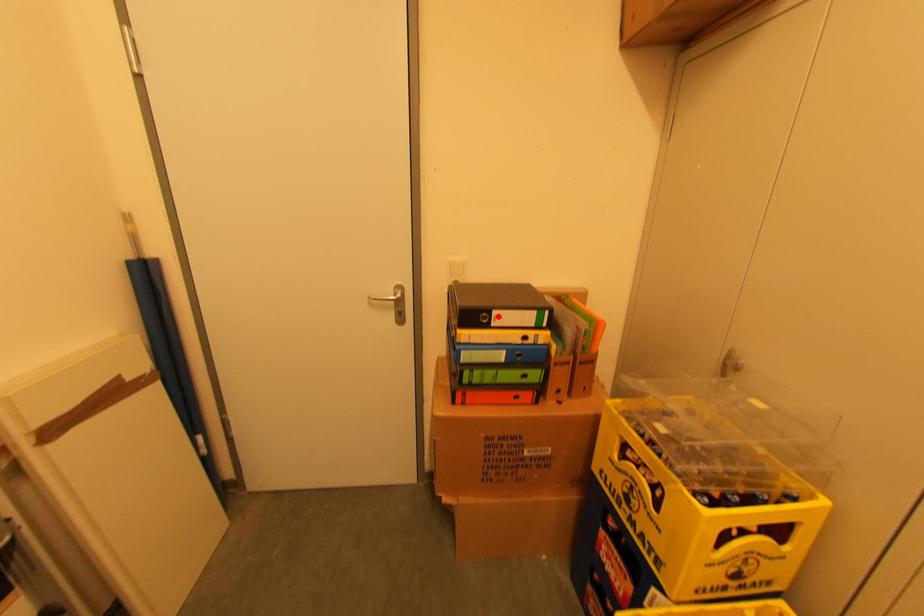
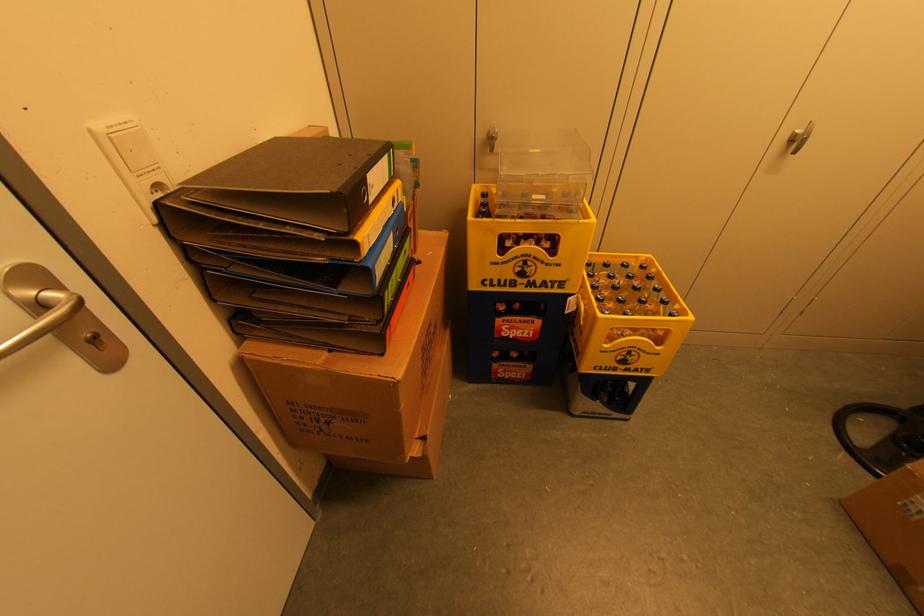
Locate, in the second image, the point that corresponds to the highlighted location in the first image.

(371, 185)